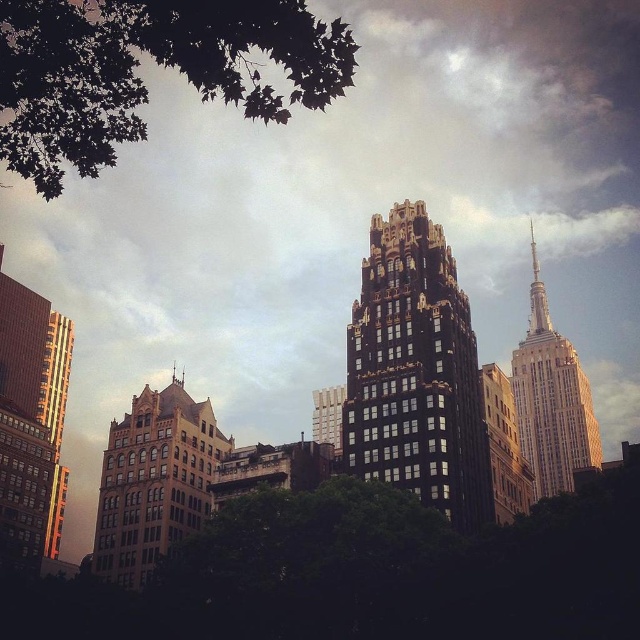
You are an urban planner assessing the city layout. You notice the black textured building at center and the white marble tower at upper right. Which of these two buildings is closer to the observer in the image?

The black textured building at center is closer to the observer because it is positioned in front of the white marble tower at upper right.

You are a city planner assessing the distance between the black textured building at center and the white marble tower at upper right. Given that the minimum required distance between two high rise buildings in the city is 30 meters for safety regulations, can you confirm if the current distance meets the requirement?

The black textured building at center and the white marble tower at upper right are 38.52 meters apart from each other, which exceeds the 30 meters minimum requirement, so the distance is compliant with safety regulations.

You are standing in the city and want to take a photo of the black textured building at center. If your camera has a maximum zoom range of 100 feet, can you capture the entire building in the photo without moving closer?

The black textured building at center is 210.49 feet from viewer. Since the camera can only zoom up to 100 feet, you cannot capture the entire building without moving closer.